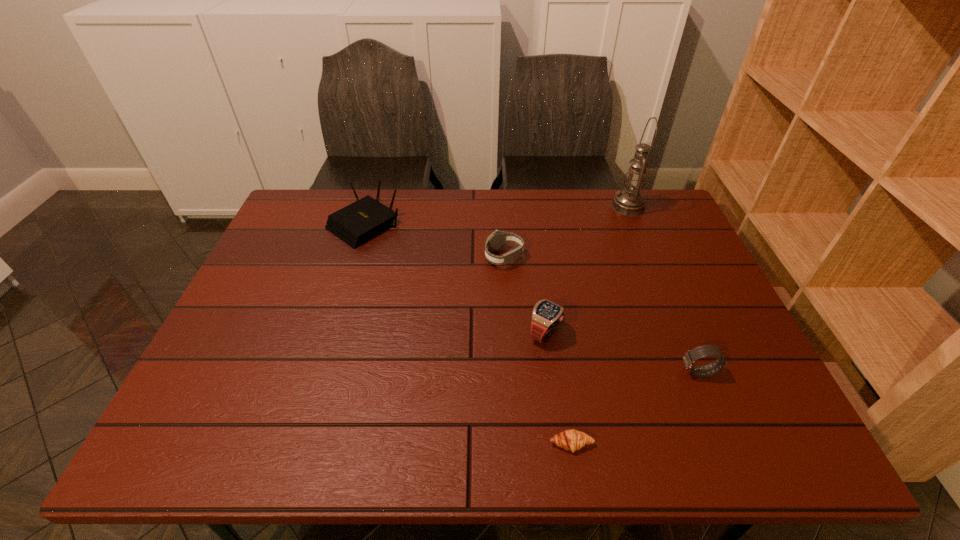
You are a GUI agent. You are given a task and a screenshot of the screen. Output one action in this format:
    pyautogui.click(x=<x>, y=<y>)
    Task: Click on the vacant area that lies between the nearest watch and the farthest watch
    The height and width of the screenshot is (540, 960).
    Given the screenshot: What is the action you would take?
    pyautogui.click(x=601, y=315)

Find the location of a particular element. free area in between the leftmost object and the rightmost watch is located at coordinates (532, 299).

Identify the location of unoccupied position between the router and the rightmost watch. This screenshot has width=960, height=540. (532, 299).

The image size is (960, 540). Find the location of `unoccupied position between the nearest watch and the farthest watch`. unoccupied position between the nearest watch and the farthest watch is located at coordinates (601, 315).

Locate an element on the screen. This screenshot has height=540, width=960. unoccupied area between the oil lamp and the rightmost watch is located at coordinates (663, 289).

Find the location of a particular element. The height and width of the screenshot is (540, 960). free space between the leftmost object and the oil lamp is located at coordinates (496, 216).

Where is `empty location between the oil lamp and the nearest object`? Image resolution: width=960 pixels, height=540 pixels. empty location between the oil lamp and the nearest object is located at coordinates (600, 326).

I want to click on free spot between the farthest watch and the oil lamp, so click(x=566, y=232).

In order to click on free space that is in between the leftmost object and the third nearest object in this screenshot , I will do `click(455, 279)`.

The width and height of the screenshot is (960, 540). I want to click on vacant space that is in between the farthest watch and the router, so coord(434,241).